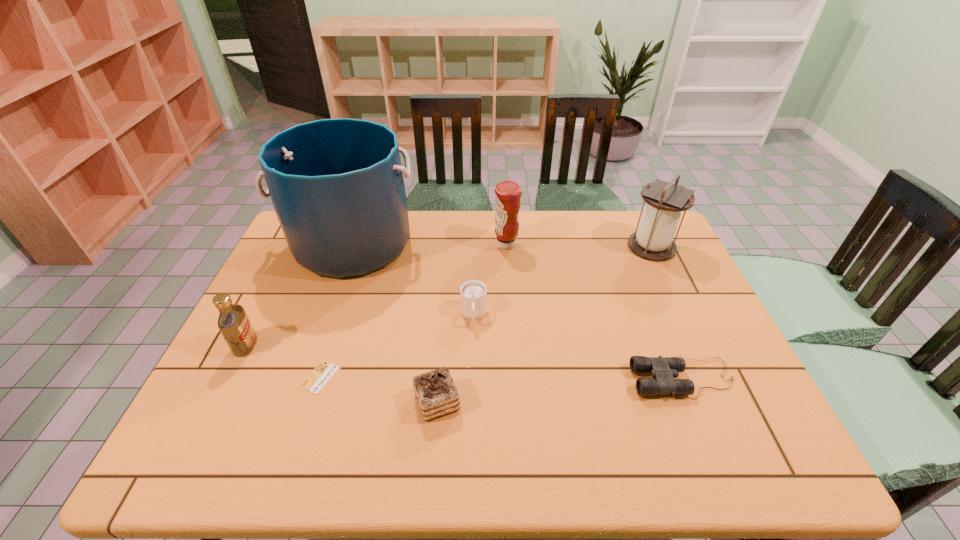
The height and width of the screenshot is (540, 960). I want to click on lantern that is at the far edge, so click(x=653, y=239).

Where is `condiment present at the far edge`? This screenshot has width=960, height=540. condiment present at the far edge is located at coordinates (508, 193).

Locate an element on the screen. The width and height of the screenshot is (960, 540). bucket located in the left edge section of the desktop is located at coordinates (337, 187).

Identify the location of vodka located at the left edge. (233, 322).

Identify the location of lantern that is at the right edge. (653, 239).

This screenshot has height=540, width=960. What are the coordinates of `binoculars at the right edge` in the screenshot? It's located at (663, 370).

The height and width of the screenshot is (540, 960). Identify the location of object located at the far left corner. (337, 187).

The image size is (960, 540). I want to click on object present at the far right corner, so click(x=653, y=239).

In the image, there is a desktop. Where is `vacant space at the far edge`? This screenshot has height=540, width=960. vacant space at the far edge is located at coordinates (537, 234).

Find the location of `free space at the near edge of the desktop`. free space at the near edge of the desktop is located at coordinates (658, 452).